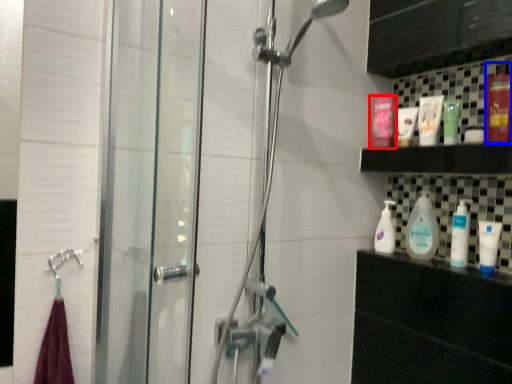
Question: Among these objects, which one is farthest to the camera, mouthwash (highlighted by a red box) or mouthwash (highlighted by a blue box)?

Choices:
 (A) mouthwash
 (B) mouthwash

Answer: (A)